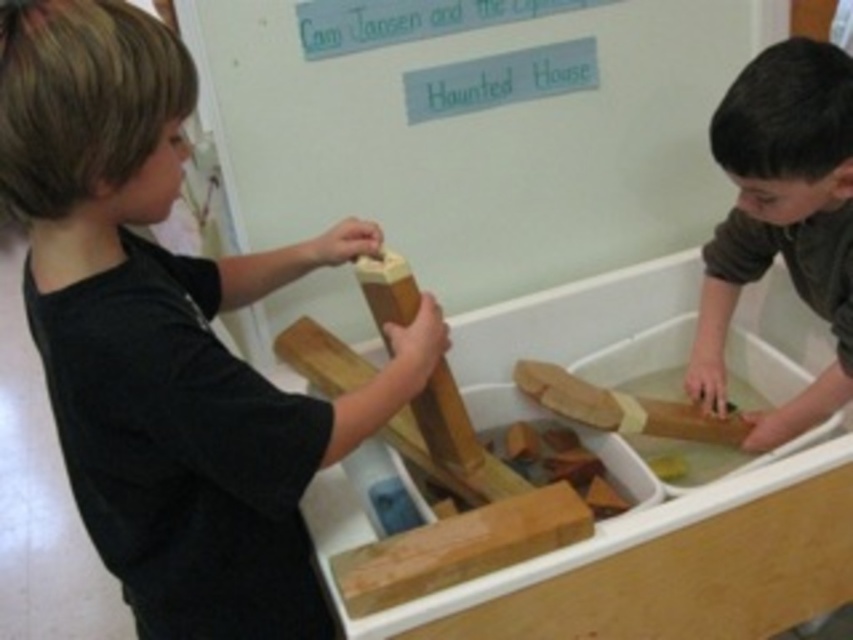
Does point (198, 440) come closer to viewer compared to point (468, 515)?

Yes, point (198, 440) is closer to viewer.

Who is positioned more to the left, matte black shirt at left or smooth light brown wood at center?

matte black shirt at left is more to the left.

Who is more forward, (216, 570) or (523, 513)?

Positioned in front is point (216, 570).

Where is `matte black shirt at left`? matte black shirt at left is located at coordinates (167, 336).

Can you confirm if wooden sign at upper center is wider than smooth light brown wood at center?

Indeed, wooden sign at upper center has a greater width compared to smooth light brown wood at center.

Between point (753, 44) and point (422, 588), which one is positioned behind?

The point (753, 44) is more distant.

The height and width of the screenshot is (640, 853). What do you see at coordinates (479, 140) in the screenshot?
I see `wooden sign at upper center` at bounding box center [479, 140].

Image resolution: width=853 pixels, height=640 pixels. Find the location of `wooden sign at upper center`. wooden sign at upper center is located at coordinates (479, 140).

Based on the photo, who is taller, matte black shirt at left or smooth brown wood at right?

matte black shirt at left is taller.

Is point (79, 204) closer to viewer compared to point (699, 369)?

That is True.

This screenshot has height=640, width=853. I want to click on matte black shirt at left, so click(x=167, y=336).